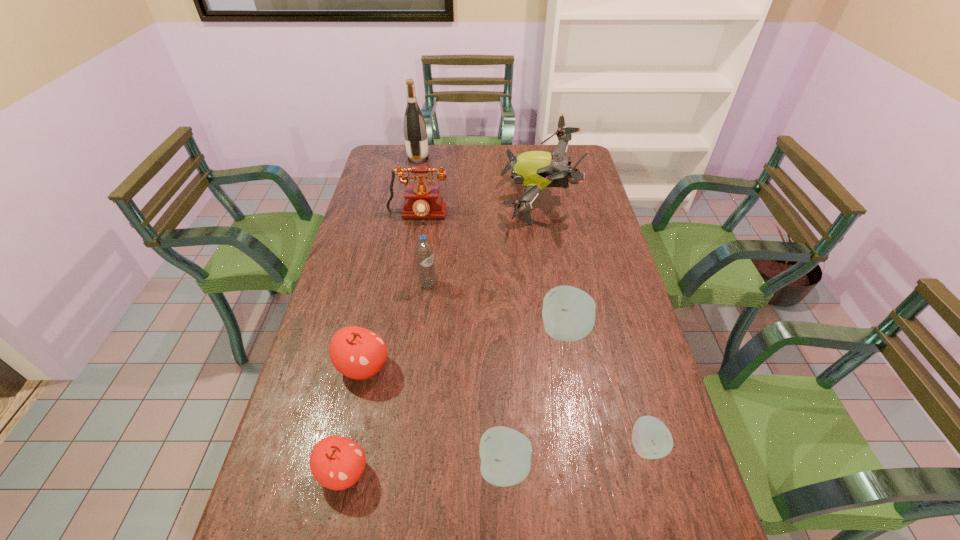
In order to click on free space between the farthest object and the farther red apple in this screenshot , I will do `click(391, 263)`.

Where is `vacant region between the water bottle and the second smallest white apple`? vacant region between the water bottle and the second smallest white apple is located at coordinates (467, 376).

Where is `free space between the tallest object and the farther red apple`? This screenshot has height=540, width=960. free space between the tallest object and the farther red apple is located at coordinates (391, 263).

What are the coordinates of `object that ranks as the third closest to the telephone` in the screenshot? It's located at (415, 132).

Identify the location of the fourth closest object to the nearer red apple. (424, 253).

Choose which apple is the second nearest neighbor to the fourth apple from left to right. Please provide its 2D coordinates. Your answer should be formatted as a tuple, i.e. [(x, y)], where the tuple contains the x and y coordinates of a point satisfying the conditions above.

[(505, 453)]

You are a GUI agent. You are given a task and a screenshot of the screen. Output one action in this format:
    pyautogui.click(x=<x>, y=<y>)
    Task: Click on the apple that is the second closest to the telephone
    
    Given the screenshot: What is the action you would take?
    [x=358, y=353]

Identify which white apple is the nearest to the water bottle. Please provide its 2D coordinates. Your answer should be formatted as a tuple, i.e. [(x, y)], where the tuple contains the x and y coordinates of a point satisfying the conditions above.

[(568, 313)]

What are the coordinates of `the second closest white apple to the nearer red apple` in the screenshot? It's located at (568, 313).

Where is `red apple object that ranks as the closest to the tallest object`? This screenshot has width=960, height=540. red apple object that ranks as the closest to the tallest object is located at coordinates (358, 353).